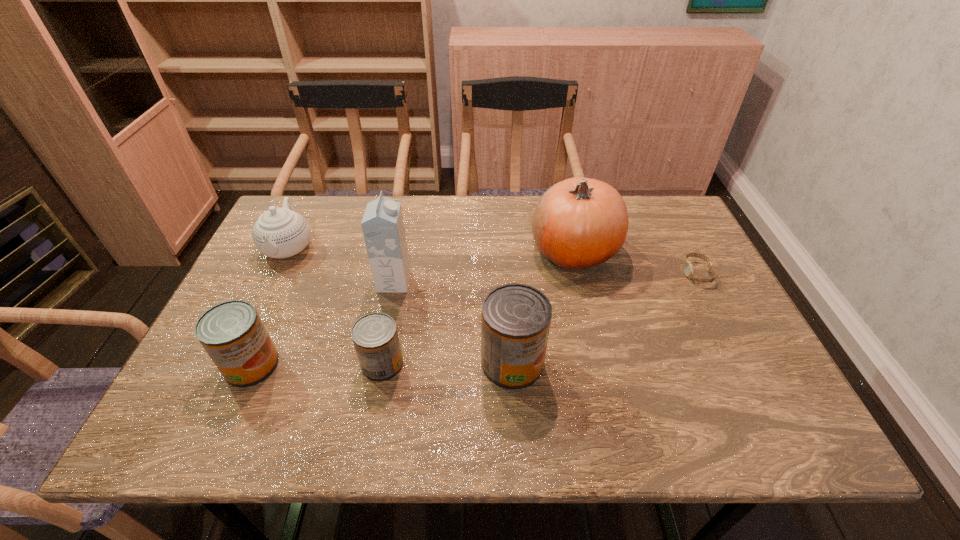
Where is `blank space at the near right corner of the desktop`? The width and height of the screenshot is (960, 540). blank space at the near right corner of the desktop is located at coordinates (705, 399).

Locate an element on the screen. This screenshot has width=960, height=540. free space between the second shortest can and the carton is located at coordinates (323, 323).

Where is `free space between the chinaware and the third object from right to left`? The image size is (960, 540). free space between the chinaware and the third object from right to left is located at coordinates (x=400, y=306).

At what (x,y) coordinates should I click in order to perform the action: click on empty location between the shortest can and the second tallest can. Please return your answer as a coordinate pair (x, y). Looking at the image, I should click on (317, 364).

Locate an element on the screen. The image size is (960, 540). free space between the carton and the chinaware is located at coordinates (342, 265).

Find the location of `vacant space that's between the sixth object from left to right and the chinaware`. vacant space that's between the sixth object from left to right and the chinaware is located at coordinates (431, 249).

I want to click on free spot between the leftmost can and the shortest object, so click(474, 319).

The height and width of the screenshot is (540, 960). Find the location of `vacant area between the chinaware and the second shortest object`. vacant area between the chinaware and the second shortest object is located at coordinates (335, 306).

Where is `free point between the chinaware and the watch`? This screenshot has width=960, height=540. free point between the chinaware and the watch is located at coordinates (492, 261).

You are a GUI agent. You are given a task and a screenshot of the screen. Output one action in this format:
    pyautogui.click(x=<x>, y=<y>)
    Task: Click on the object that stands as the third closest to the carton
    The width and height of the screenshot is (960, 540).
    Given the screenshot: What is the action you would take?
    (x=515, y=318)